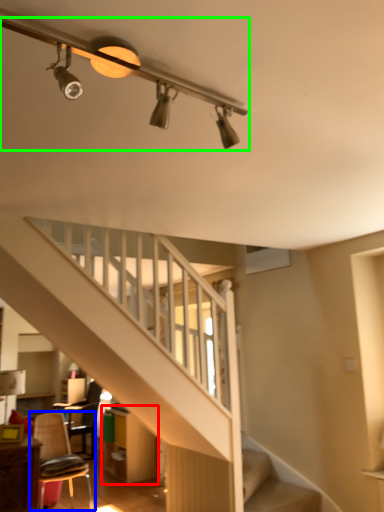
Question: Which object is the farthest from dresser (highlighted by a red box)? Choose among these: chair (highlighted by a blue box) or light fixture (highlighted by a green box).

Choices:
 (A) chair
 (B) light fixture

Answer: (B)